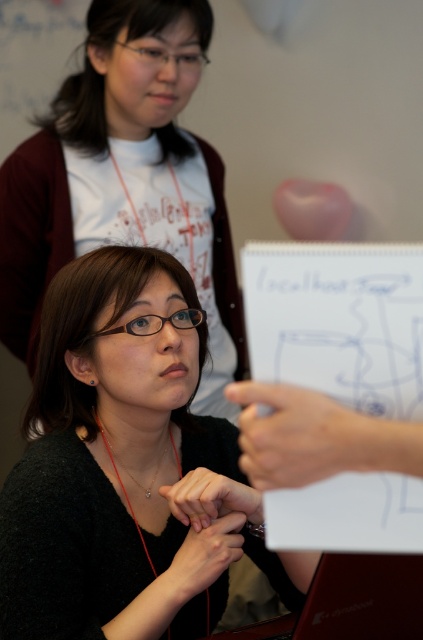
You are a photographer adjusting your camera to capture a closeup of the matte black shirt at center and the gold chain necklace at center. The camera has a minimum focus distance of 30 inches. Can you focus on both objects without moving the camera?

The distance between the matte black shirt at center and gold chain necklace at center is 31.16 inches, which is greater than the camera minimum focus distance of 30 inches. Therefore, the camera can focus on both objects without moving.

You are standing in the room and want to locate the black matte sweater at center. According to the spatial coordinates provided, where should you look?

The black matte sweater at center is located at point 0.731 on the x axis and 0.298 on the y axis.

You are standing in the room and see the matte black shirt at center and the gold chain necklace at center. Which one is positioned more to the left?

The matte black shirt at center is positioned to the left of the gold chain necklace at center.